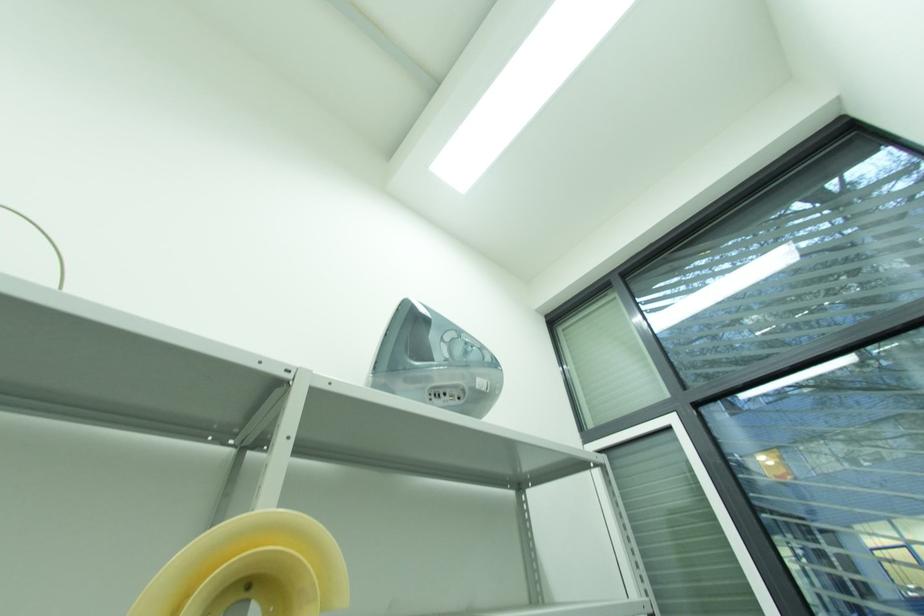
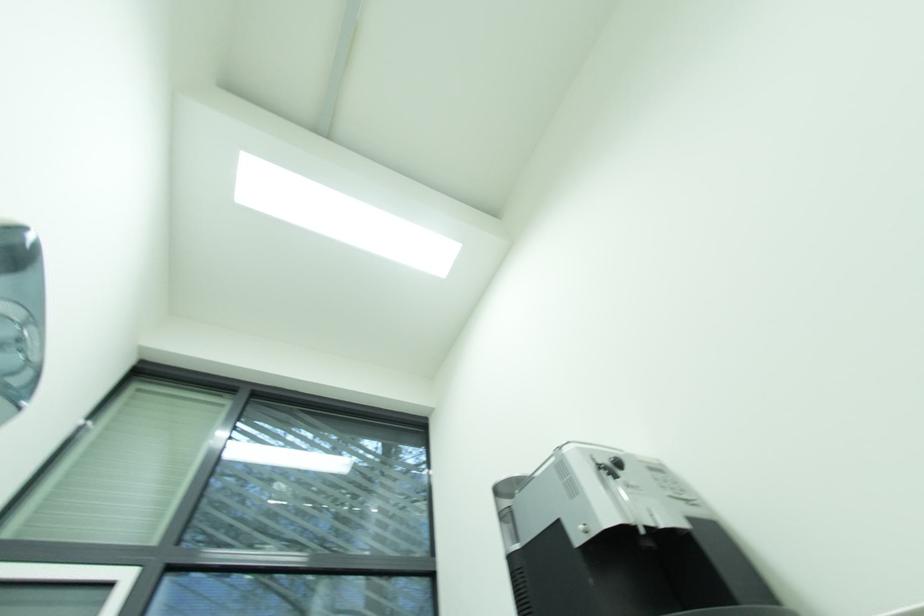
The first image is from the beginning of the video and the second image is from the end. How did the camera likely rotate when shooting the video?

The camera's rotation is toward right-up.